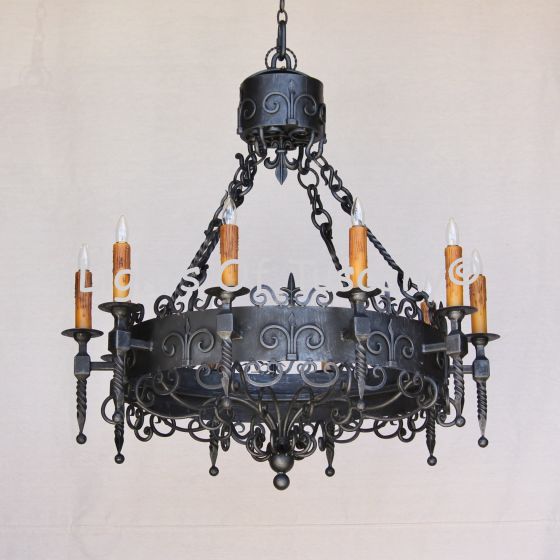
Find the location of a particular element. lights is located at coordinates (87, 256), (126, 228), (228, 211), (357, 210), (452, 232), (477, 260), (429, 287).